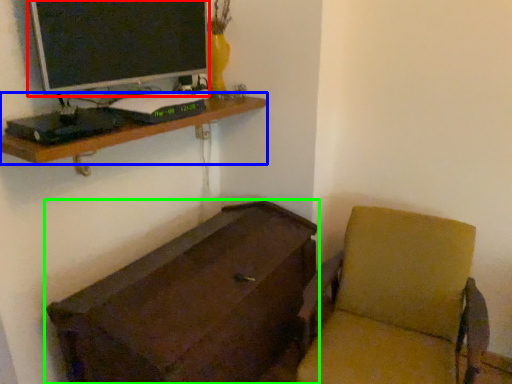
Question: Based on their relative distances, which object is farther from computer monitor (highlighted by a red box)? Choose from shelf (highlighted by a blue box) and furniture (highlighted by a green box).

Choices:
 (A) shelf
 (B) furniture

Answer: (B)